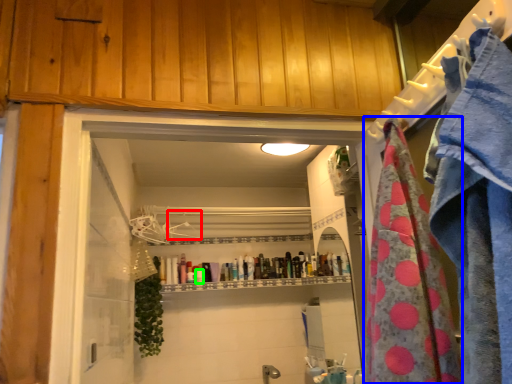
Question: Estimate the real-world distances between objects in this image. Which object is closer to hanger (highlighted by a red box), beach towel (highlighted by a blue box) or toiletry (highlighted by a green box)?

Choices:
 (A) beach towel
 (B) toiletry

Answer: (B)